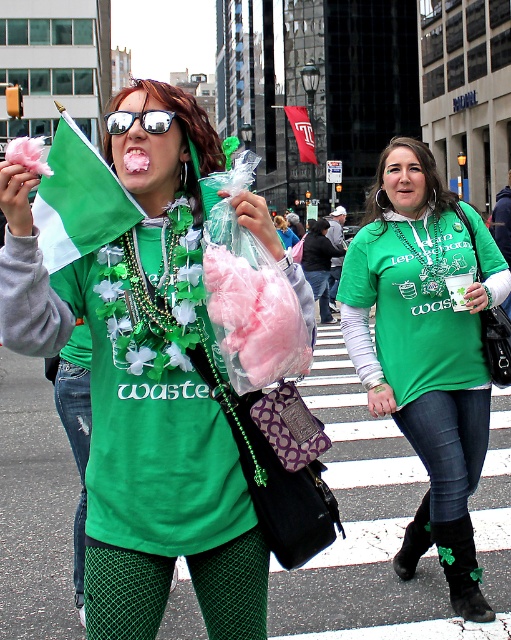
Consider the image. Is green fabric flag at upper left below reflective plastic sunglasses at upper center?

Actually, green fabric flag at upper left is above reflective plastic sunglasses at upper center.

Is point (81, 211) positioned behind point (114, 131)?

No, (81, 211) is in front of (114, 131).

Between point (77, 227) and point (134, 115), which one is positioned in front?

Point (77, 227) is more forward.

Locate an element on the screen. The width and height of the screenshot is (511, 640). green fabric flag at upper left is located at coordinates (79, 198).

Consider the image. Is green fabric flag at upper left wider than red fabric flag at center?

Incorrect, green fabric flag at upper left's width does not surpass red fabric flag at center's.

Is point (82, 218) behind point (310, 145)?

No, it is in front of (310, 145).

Based on the photo, who is more forward, [122,230] or [308,131]?

Point [122,230]

Locate an element on the screen. This screenshot has width=511, height=640. green fabric flag at upper left is located at coordinates (79, 198).

You are a GUI agent. You are given a task and a screenshot of the screen. Output one action in this format:
    pyautogui.click(x=<x>, y=<y>)
    Task: Click on the reflective plastic sunglasses at upper center
    The height and width of the screenshot is (640, 511).
    Given the screenshot: What is the action you would take?
    pyautogui.click(x=138, y=120)